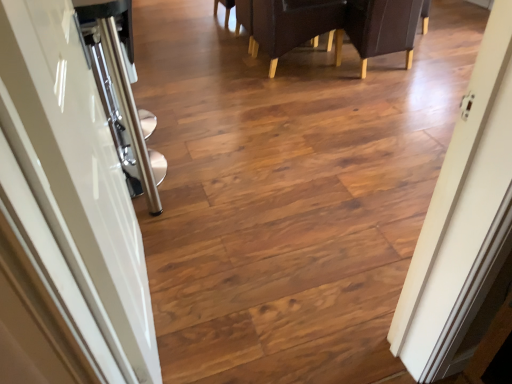
What are the coordinates of `vacant area that lies between dark brown leather armchair at upper center, arranged as the 2th armchair when viewed from the right, and dark brown leather armchair at upper right, positioned as the first armchair in right-to-left order` in the screenshot? It's located at (322, 81).